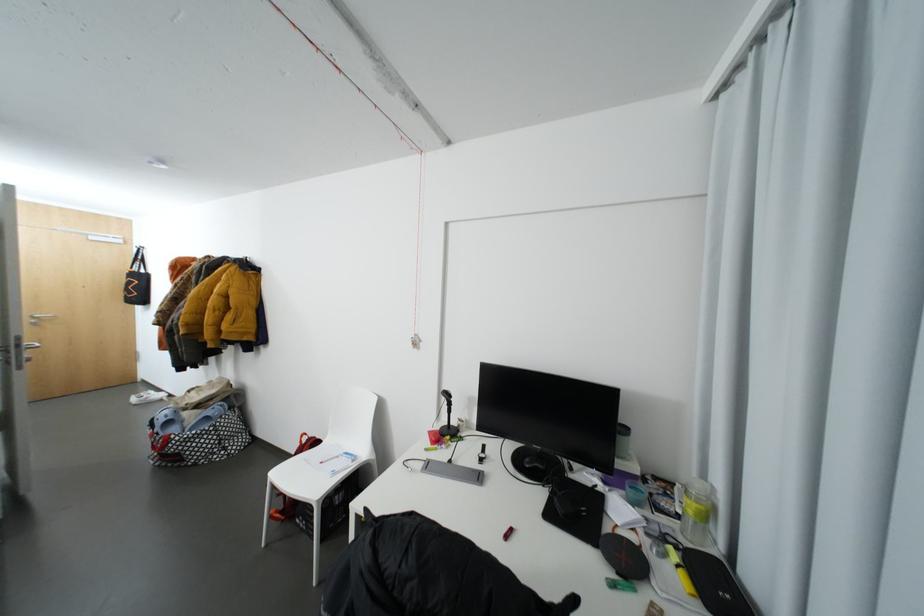
Where is `white chair sitting surface`? This screenshot has width=924, height=616. white chair sitting surface is located at coordinates (325, 460).